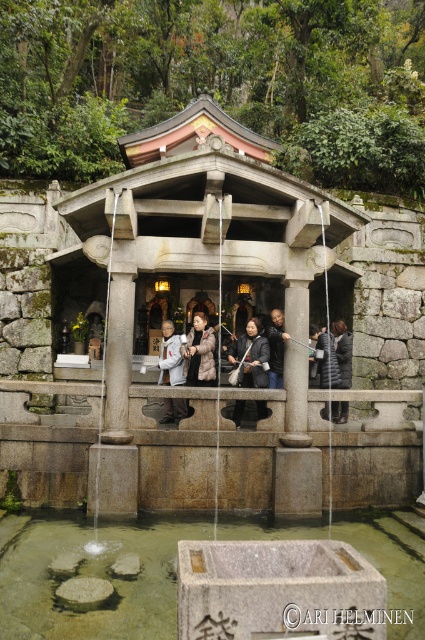
Question: Which of these objects is positioned farthest from the dark gray down jacket at center?

Choices:
 (A) dark gray stone person at center
 (B) dark brown leather jacket at center
 (C) dark gray fabric jacket at center
 (D) black leather jacket at center

Answer: (A)

Question: Does dark gray down jacket at center have a larger size compared to dark brown leather jacket at center?

Choices:
 (A) no
 (B) yes

Answer: (A)

Question: Does dark brown leather jacket at center come in front of dark gray stone person at center?

Choices:
 (A) no
 (B) yes

Answer: (B)

Question: Among these points, which one is nearest to the camera?

Choices:
 (A) (275, 378)
 (B) (170, 362)
 (C) (258, 336)
 (D) (408, 528)

Answer: (D)

Question: Estimate the real-world distances between objects in this image. Which object is farther from the dark gray fabric jacket at center?

Choices:
 (A) transparent stone water at center
 (B) dark brown leather jacket at center

Answer: (A)

Question: Is transparent stone water at center above dark brown leather jacket at center?

Choices:
 (A) no
 (B) yes

Answer: (A)